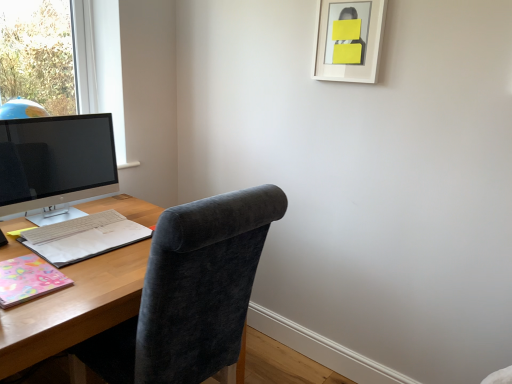
I want to click on free space in front of multicolored paper notebook at left, acting as the first notebook starting from the back, so click(87, 279).